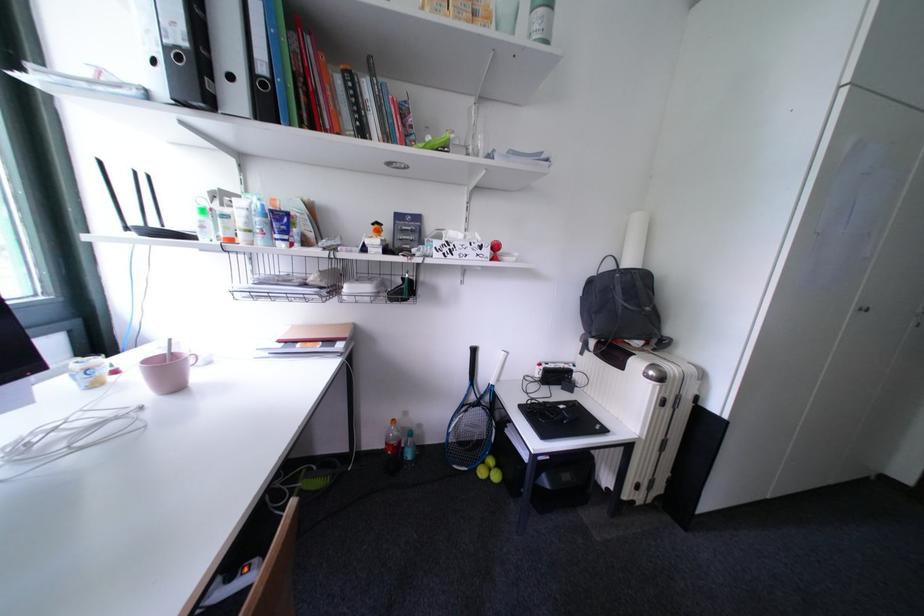
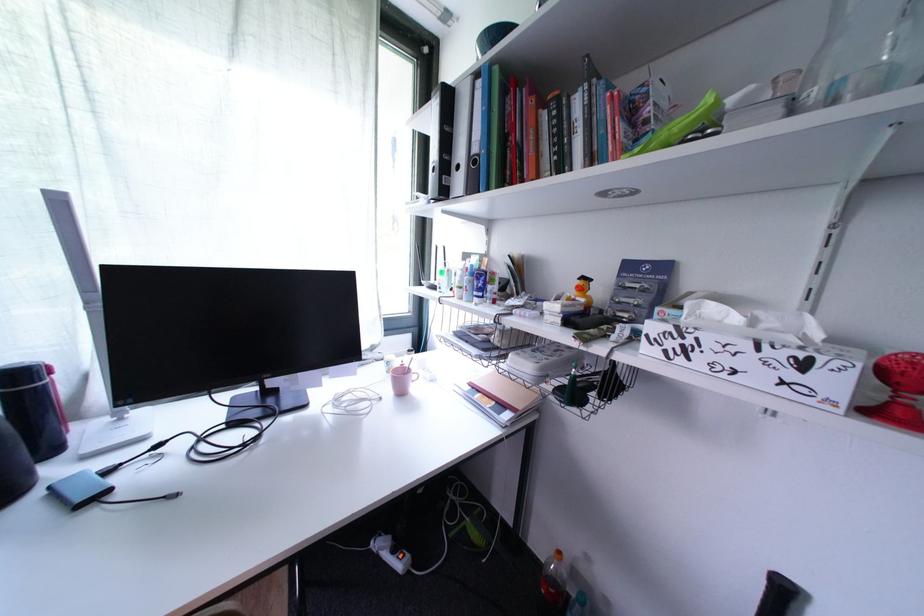
Find the pixel in the second image that matches point (468, 238) in the first image.

(745, 321)